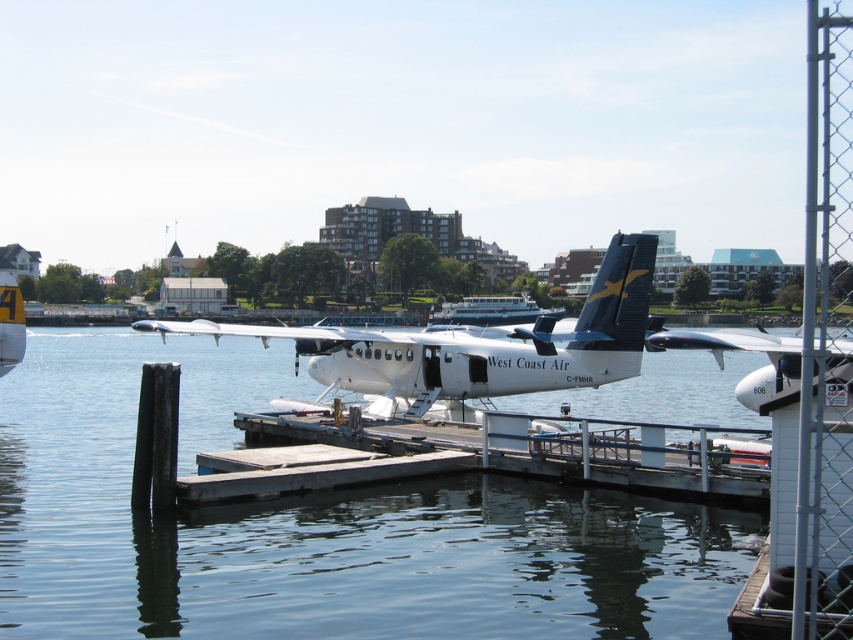
You are a maintenance worker needing to reach the white matte seaplane at center from the clear water at dock center. Given that your boat can only navigate up to 20 meters, will you be able to reach the seaplane?

The clear water at dock center and white matte seaplane at center are 19.93 meters apart from each other. Since your boat can navigate up to 20 meters, you can reach the white matte seaplane at center.

You are a passenger waiting to board the white matte airplane at center. You see the clear water at dock center below the airplane. Is the airplane currently on the water or on land?

The white matte airplane at center is on the water because the clear water at dock center is below it, indicating that the airplane is resting on the water via its pontoons.

You are a pilot standing at the point with coordinates (x=743, y=349). You need to board the white matte seaplane at center. Can you walk directly to the seaplane from your current position?

The white matte seaplane at center is located at point (x=743, y=349), so you are already at the same location as the white matte seaplane at center. You don not need to walk anywhere to board it.